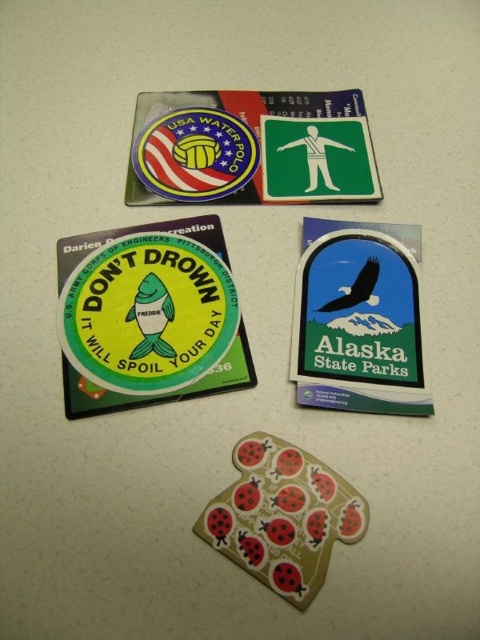
Between metallic gold ladybug at center and green matte sticker at upper right, which one has more height?

metallic gold ladybug at center is taller.

Which is below, metallic gold ladybug at center or green matte sticker at upper right?

metallic gold ladybug at center is lower down.

Where is `metallic gold ladybug at center`? The width and height of the screenshot is (480, 640). metallic gold ladybug at center is located at coordinates [x=283, y=516].

Where is `metallic gold ladybug at center`? This screenshot has height=640, width=480. metallic gold ladybug at center is located at coordinates (283, 516).

Does green matte sticker at lower left have a smaller size compared to green matte sticker at upper right?

Incorrect, green matte sticker at lower left is not smaller in size than green matte sticker at upper right.

Between green matte sticker at lower left and green matte sticker at upper right, which one has less height?

With less height is green matte sticker at upper right.

Is point (205, 310) behind point (312, 394)?

Yes, it is.

Where is `green matte sticker at lower left`? green matte sticker at lower left is located at coordinates (148, 316).

Based on the photo, measure the distance between green matte sticker at lower left and camera.

green matte sticker at lower left is 30.60 inches away from camera.

Is green matte sticker at lower left wider than metallic gold ladybug at center?

Correct, the width of green matte sticker at lower left exceeds that of metallic gold ladybug at center.

This screenshot has height=640, width=480. What are the coordinates of `green matte sticker at lower left` in the screenshot? It's located at pyautogui.click(x=148, y=316).

Locate an element on the screen. The height and width of the screenshot is (640, 480). green matte sticker at lower left is located at coordinates [x=148, y=316].